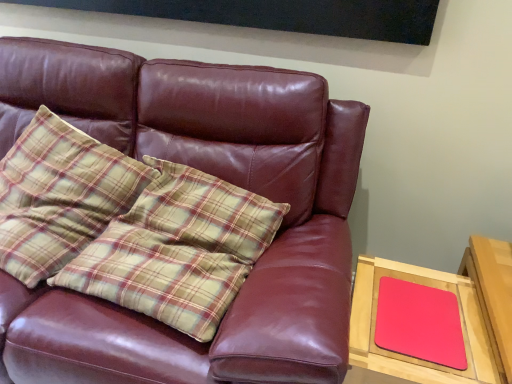
You are a GUI agent. You are given a task and a screenshot of the screen. Output one action in this format:
    pyautogui.click(x=<x>, y=<y>)
    Task: Click on the empty space that is ontop of matte pink mousepad at right (from a real-world perspective)
    The height and width of the screenshot is (384, 512).
    Given the screenshot: What is the action you would take?
    pyautogui.click(x=421, y=311)